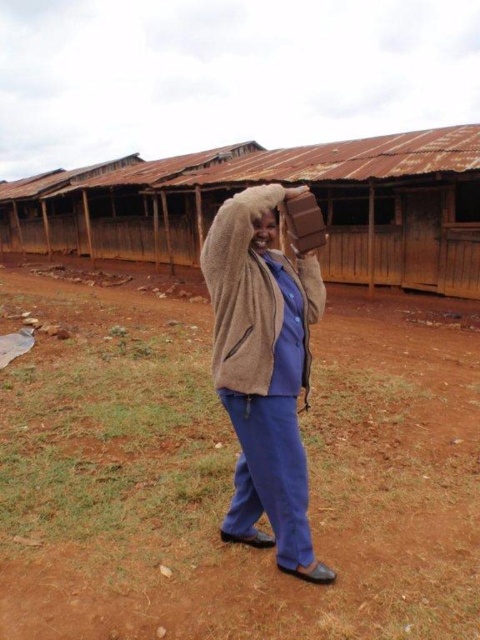
You are a hiker who just arrived at the scene. You need to place a 10 feet long tent between the brown dirt field at center and the brown fuzzy hat at center. Is there enough space?

The distance between the brown dirt field at center and the brown fuzzy hat at center is 8.74 feet. Since the tent requires 10 feet of space, there is not enough room to place it between them.

You are standing in the middle of the scene and see the brown dirt field at center and the fuzzy brown sweater at center. Which object is positioned to the left of the other?

The brown dirt field at center is to the left of the fuzzy brown sweater at center.